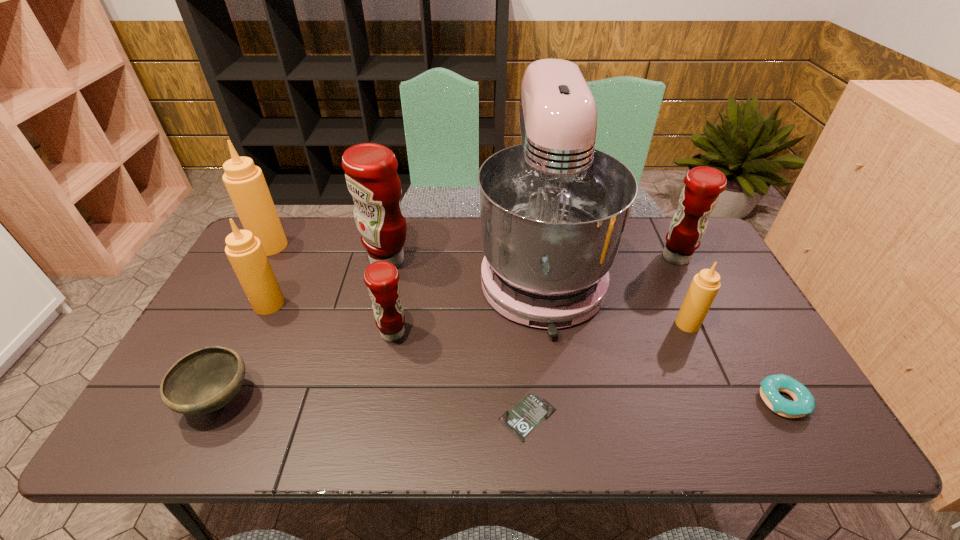
I want to click on blank space located on the left of the identity card, so click(x=454, y=417).

Where is `mixer at the far edge`? The width and height of the screenshot is (960, 540). mixer at the far edge is located at coordinates (553, 210).

You are a GUI agent. You are given a task and a screenshot of the screen. Output one action in this format:
    pyautogui.click(x=<x>, y=<y>)
    Task: Click on the bowl that is at the near edge
    The height and width of the screenshot is (540, 960).
    Given the screenshot: What is the action you would take?
    pyautogui.click(x=205, y=380)

At what (x,y) coordinates should I click in order to perform the action: click on doughnut positioned at the near edge. Please return your answer as a coordinate pair (x, y). Image resolution: width=960 pixels, height=540 pixels. Looking at the image, I should click on (804, 403).

At what (x,y) coordinates should I click in order to perform the action: click on identity card that is at the near edge. Please return your answer as a coordinate pair (x, y). This screenshot has height=540, width=960. Looking at the image, I should click on (524, 417).

At what (x,y) coordinates should I click in order to perform the action: click on bowl that is at the left edge. Please return your answer as a coordinate pair (x, y). Looking at the image, I should click on (205, 380).

The image size is (960, 540). What are the coordinates of `doughnut that is at the right edge` in the screenshot? It's located at (804, 403).

Identify the location of object present at the far left corner. This screenshot has width=960, height=540. (245, 183).

Where is `object situated at the near left corner`? object situated at the near left corner is located at coordinates (205, 380).

Where is `object at the far right corner`? object at the far right corner is located at coordinates (703, 185).